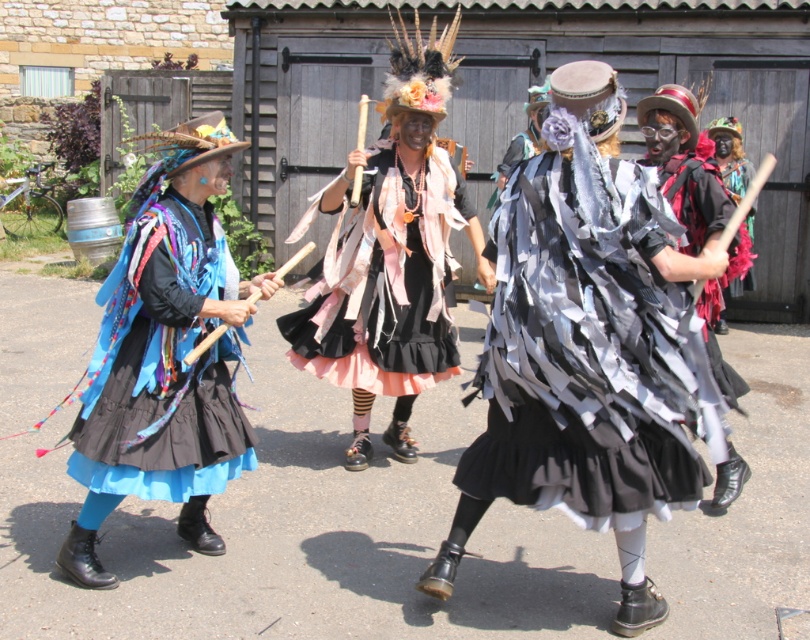
Question: Can you confirm if ruffled pink fabric skirt at center is wider than matte blue fabric skirt at left?

Choices:
 (A) no
 (B) yes

Answer: (B)

Question: Does ruffled pink fabric skirt at center have a lesser width compared to black feathered headdress at center?

Choices:
 (A) yes
 (B) no

Answer: (B)

Question: Does ruffled pink fabric skirt at center have a larger size compared to black feathered headdress at center?

Choices:
 (A) no
 (B) yes

Answer: (B)

Question: Estimate the real-world distances between objects in this image. Which object is farther from the matte blue fabric skirt at left?

Choices:
 (A) shiny metallic ribbons at center
 (B) black feathered headdress at center

Answer: (B)

Question: Among these objects, which one is farthest from the camera?

Choices:
 (A) black feathered headdress at center
 (B) matte blue fabric skirt at left
 (C) shiny metallic ribbons at center
 (D) ruffled pink fabric skirt at center

Answer: (A)

Question: Among these points, which one is farthest from the camera?

Choices:
 (A) (359, 346)
 (B) (732, 186)
 (C) (117, 451)
 (D) (680, 387)

Answer: (B)